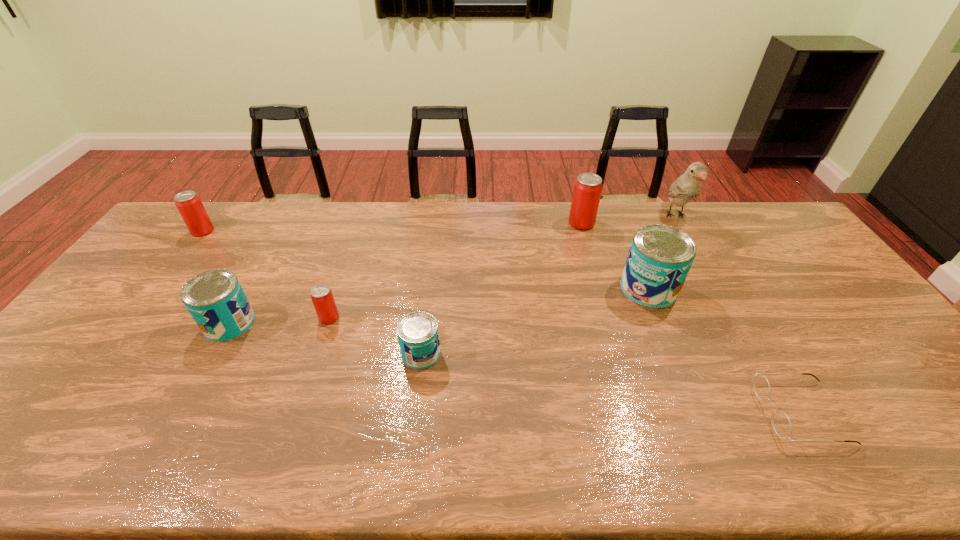
In the image, there is a desktop. At what (x,y) coordinates should I click in order to perform the action: click on vacant space at the far edge. Please return your answer as a coordinate pair (x, y). This screenshot has width=960, height=540. Looking at the image, I should click on (400, 235).

This screenshot has height=540, width=960. In the image, there is a desktop. In order to click on vacant space at the near edge in this screenshot , I will do `click(451, 442)`.

Find the location of `free region at the right edge of the desktop`. free region at the right edge of the desktop is located at coordinates (903, 382).

Image resolution: width=960 pixels, height=540 pixels. Find the location of `free space at the far left corner of the desktop`. free space at the far left corner of the desktop is located at coordinates (167, 233).

Find the location of `free space between the smallest blue can and the tallest object`. free space between the smallest blue can and the tallest object is located at coordinates (548, 285).

I want to click on free space between the rightmost can and the fourth object from left to right, so click(x=535, y=321).

You are a GUI agent. You are given a task and a screenshot of the screen. Output one action in this format:
    pyautogui.click(x=<x>, y=<y>)
    Task: Click on the free spot between the fifth object from left to right and the biggest blue can
    
    Given the screenshot: What is the action you would take?
    pyautogui.click(x=615, y=256)

Locate an element on the screen. Image resolution: width=960 pixels, height=540 pixels. vacant space that's between the rightmost blue can and the fifth can from right to left is located at coordinates (439, 306).

Locate an element on the screen. The width and height of the screenshot is (960, 540). vacant region between the rightmost red can and the fifth can from right to left is located at coordinates (405, 273).

Identify the location of vacant space that is in between the second red can from left to right and the bird. (502, 267).